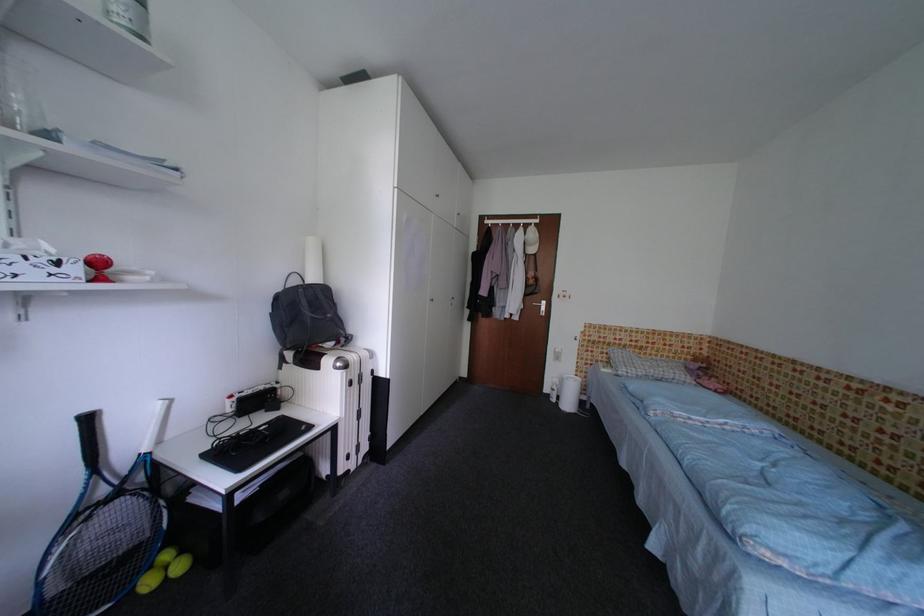
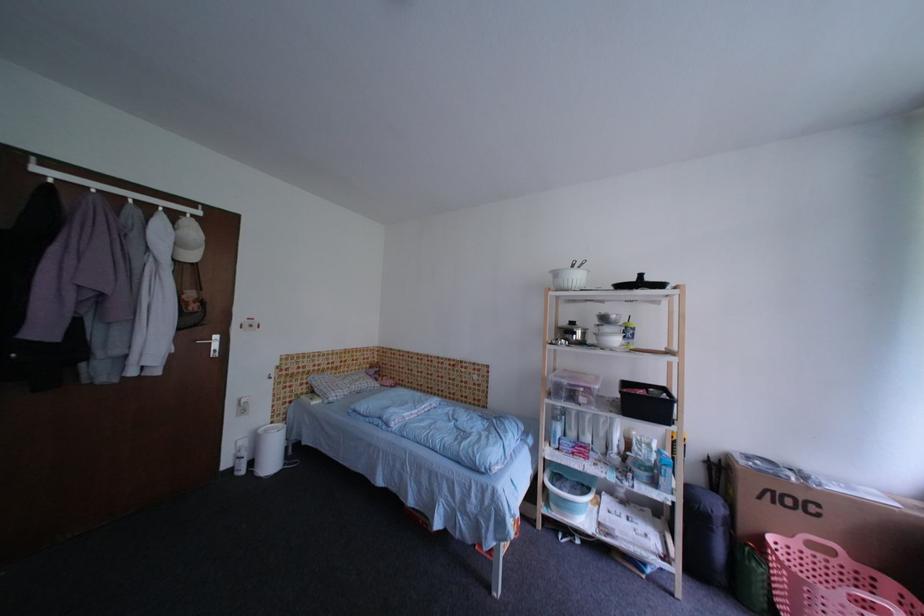
Question: Based on the continuous images, in which direction is the camera rotating? Reply with the corresponding letter.

Choices:
 (A) Left
 (B) Right
 (C) Up
 (D) Down

Answer: (B)